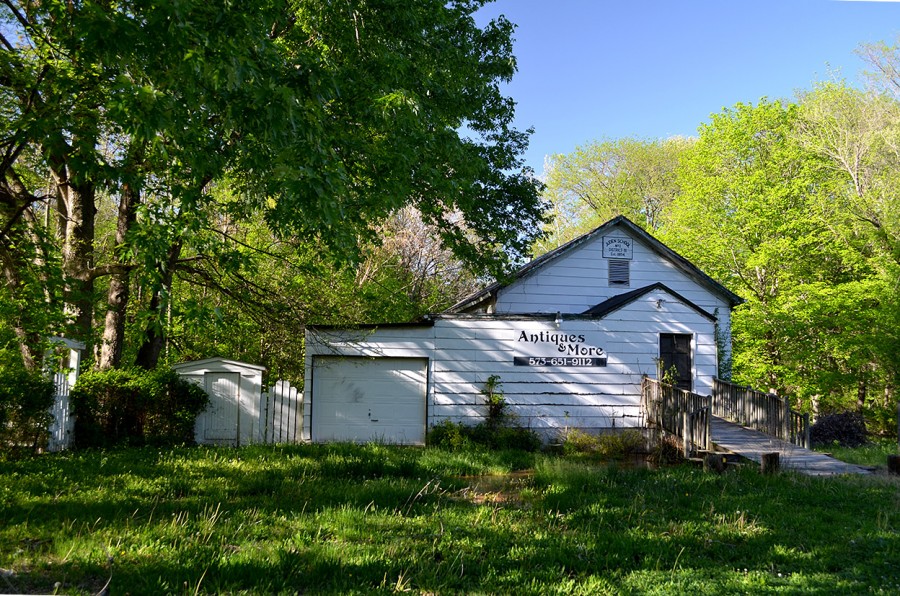
Where is `vent`? vent is located at coordinates (619, 270).